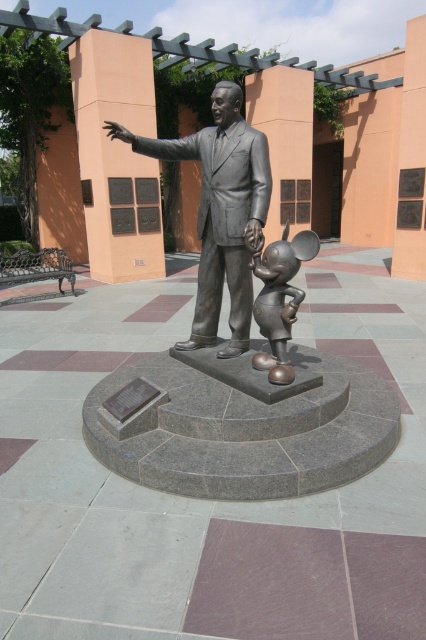
Between point (215, 312) and point (282, 228), which one is positioned behind?

Point (282, 228)

Does point (230, 269) come in front of point (291, 285)?

No.

Locate an element on the screen. The width and height of the screenshot is (426, 640). polished bronze statue at center is located at coordinates (221, 211).

Where is `polished bronze statue at center`? The width and height of the screenshot is (426, 640). polished bronze statue at center is located at coordinates (221, 211).